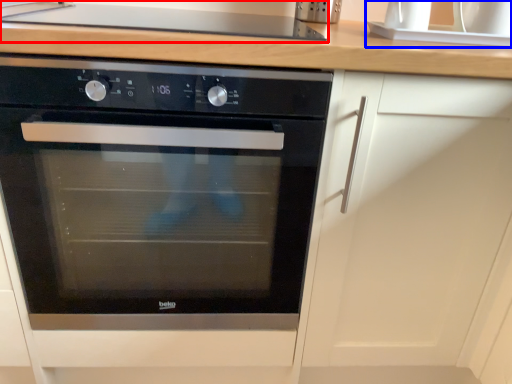
Question: Among these objects, which one is nearest to the camera, gas stove (highlighted by a red box) or sink (highlighted by a blue box)?

Choices:
 (A) gas stove
 (B) sink

Answer: (A)